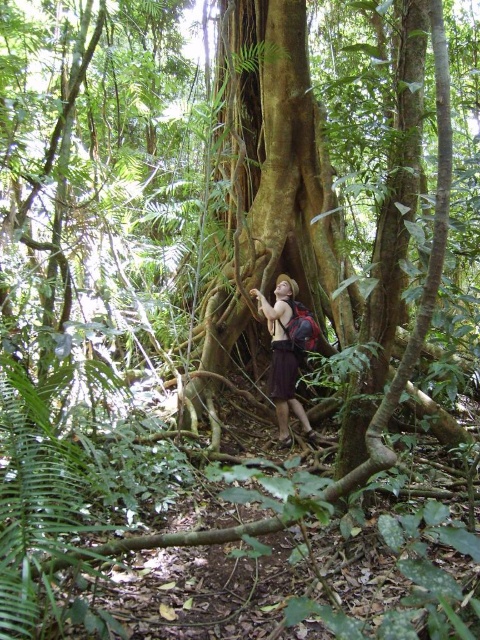
Between green rough bark tree trunk at center and brown fabric backpack at center, which one is positioned lower?

brown fabric backpack at center is lower down.

Image resolution: width=480 pixels, height=640 pixels. What do you see at coordinates (269, 205) in the screenshot?
I see `green rough bark tree trunk at center` at bounding box center [269, 205].

Which is behind, point (286, 72) or point (265, 317)?

The point (286, 72) is behind.

I want to click on green rough bark tree trunk at center, so click(269, 205).